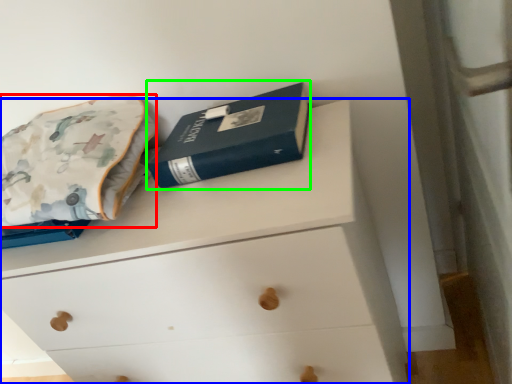
Question: Which object is positioned closest to throw pillow (highlighted by a red box)? Select from chest of drawers (highlighted by a blue box) and paperback book (highlighted by a green box).

Choices:
 (A) chest of drawers
 (B) paperback book

Answer: (B)